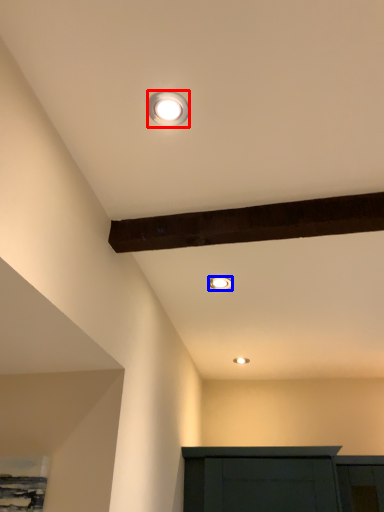
Question: Which point is closer to the camera, lamp (highlighted by a red box) or lamp (highlighted by a blue box)?

Choices:
 (A) lamp
 (B) lamp

Answer: (A)